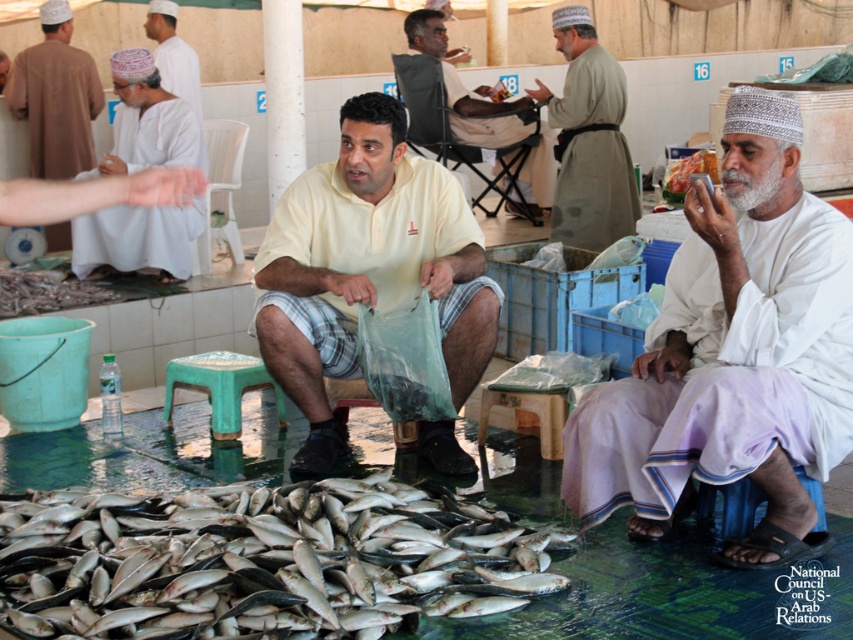
Based on the photo, who is positioned more to the left, white cotton turban at upper right or silver shiny fish at lower center?

silver shiny fish at lower center is more to the left.

Who is more distant from viewer, [679,346] or [45,548]?

The point [679,346] is behind.

What do you see at coordinates (733, 353) in the screenshot?
I see `white cotton turban at upper right` at bounding box center [733, 353].

The height and width of the screenshot is (640, 853). Identify the location of white cotton turban at upper right. (733, 353).

Looking at this image, who is positioned more to the left, yellow matte shirt at center or white cotton headscarf at upper left?

white cotton headscarf at upper left

Does yellow matte shirt at center appear on the left side of white cotton headscarf at upper left?

No, yellow matte shirt at center is not to the left of white cotton headscarf at upper left.

Is point (450, 252) farther from viewer compared to point (148, 10)?

No, it is in front of (148, 10).

This screenshot has width=853, height=640. Find the location of `yellow matte shirt at center`. yellow matte shirt at center is located at coordinates click(367, 268).

Describe the element at coordinates (55, 97) in the screenshot. I see `matte white robe at upper left` at that location.

Consider the image. Can you confirm if matte white robe at upper left is positioned above green plastic stool at center?

Yes, matte white robe at upper left is above green plastic stool at center.

Where is `matte white robe at upper left`? This screenshot has height=640, width=853. matte white robe at upper left is located at coordinates click(x=55, y=97).

Where is `matte white robe at upper left`? matte white robe at upper left is located at coordinates (55, 97).